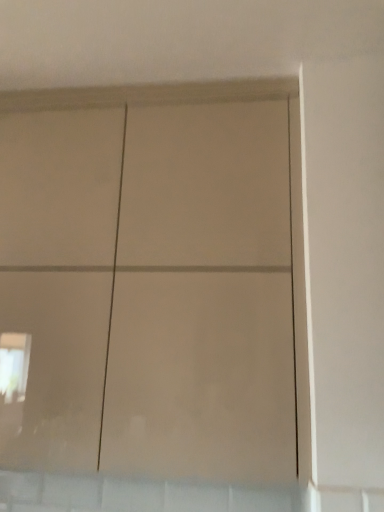
Where is `matte white cupboard at center`? The height and width of the screenshot is (512, 384). matte white cupboard at center is located at coordinates (288, 192).

What do you see at coordinates (288, 192) in the screenshot?
I see `matte white cupboard at center` at bounding box center [288, 192].

The height and width of the screenshot is (512, 384). I want to click on matte white cupboard at center, so click(x=288, y=192).